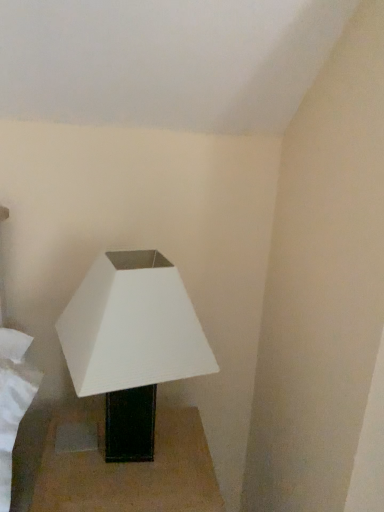
The height and width of the screenshot is (512, 384). I want to click on free area below white matte lamp at lower left (from a real-world perspective), so click(x=137, y=462).